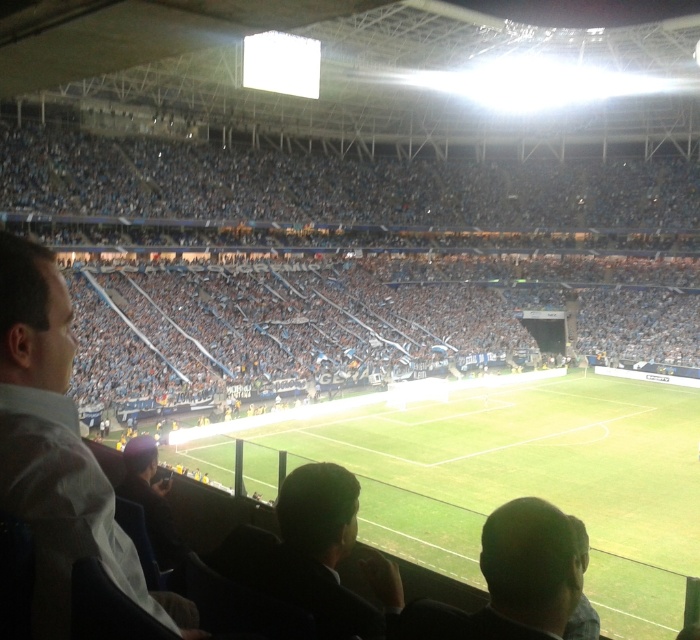
Based on the photo, you are a photographer standing in the stadium and want to capture a photo that includes both the dark brown hair at lower right and the dark green fabric at lower center. Which object should you adjust your camera angle to focus on first to ensure both fit in the frame?

Since the dark brown hair at lower right is narrower than the dark green fabric at lower center, you should focus on the dark green fabric at lower center first to ensure there is enough space for both in the frame.

You are a drone operator flying a drone over the stadium. You need to capture a photo of the point at coordinate point [650,458] and point [567,612]. From your current position, which point should you fly towards first to ensure both points are in frame?

You should fly towards point [567,612] first because point [650,458] is behind it, so capturing the closer point first ensures both points remain in frame.